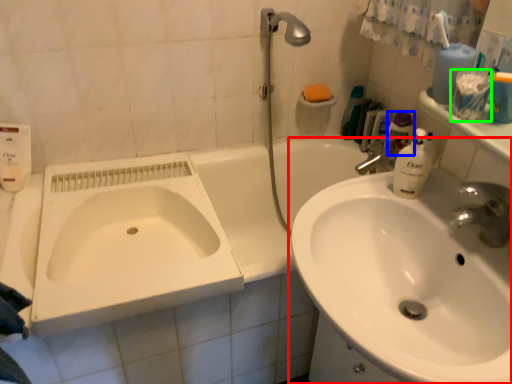
Question: Which is farther away from sink (highlighted by a red box)? toiletry (highlighted by a blue box) or mouthwash (highlighted by a green box)?

Choices:
 (A) toiletry
 (B) mouthwash

Answer: (A)